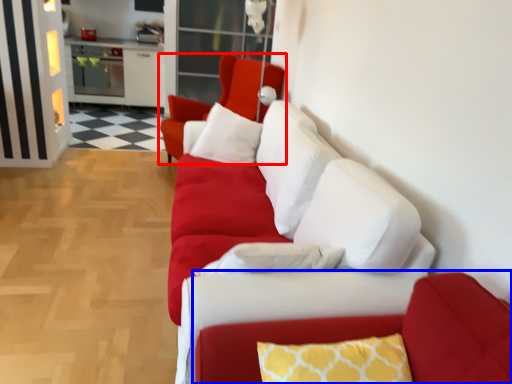
Question: Which object is closer to the camera taking this photo, chair (highlighted by a red box) or couch (highlighted by a blue box)?

Choices:
 (A) chair
 (B) couch

Answer: (B)